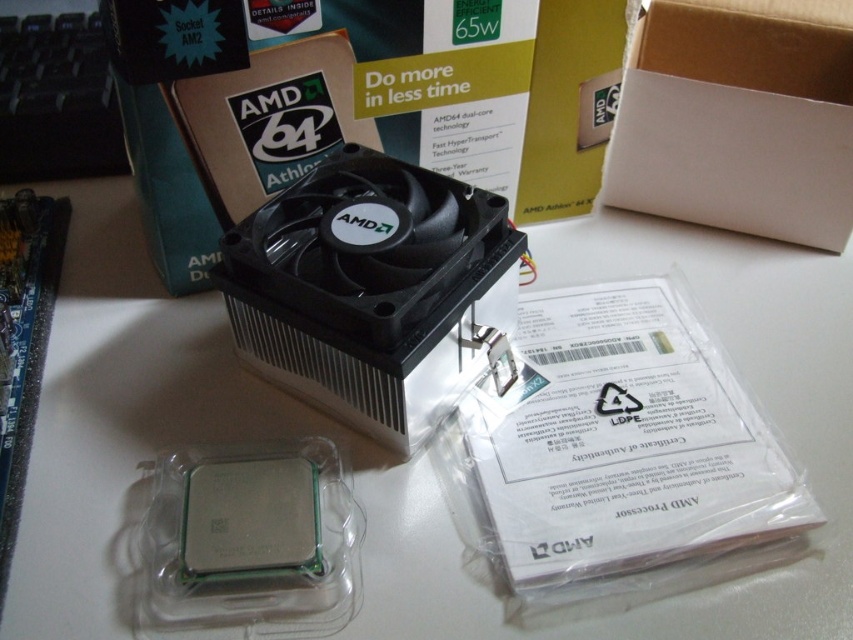
Question: Does black plastic fan at center have a larger size compared to white cardboard box at upper center?

Choices:
 (A) yes
 (B) no

Answer: (A)

Question: Which point is farther from the camera taking this photo?

Choices:
 (A) (799, 22)
 (B) (334, 252)

Answer: (A)

Question: Which object appears farthest from the camera in this image?

Choices:
 (A) white cardboard box at upper center
 (B) black plastic fan at center

Answer: (A)

Question: Does black plastic fan at center have a greater width compared to white cardboard box at upper center?

Choices:
 (A) no
 (B) yes

Answer: (B)

Question: Can you confirm if black plastic fan at center is positioned above white cardboard box at upper center?

Choices:
 (A) yes
 (B) no

Answer: (B)